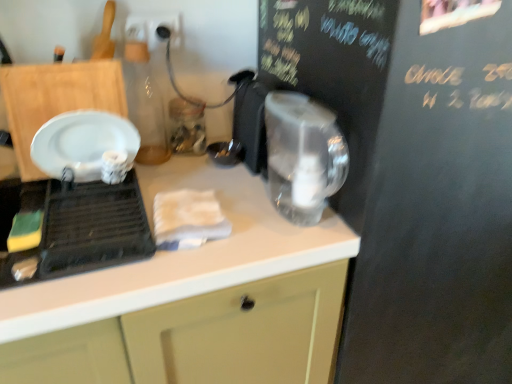
Question: Is point (59, 269) closer or farther from the camera than point (275, 205)?

Choices:
 (A) farther
 (B) closer

Answer: (B)

Question: Is white glossy plate at left in front of or behind transparent plastic kettle at center in the image?

Choices:
 (A) behind
 (B) front

Answer: (B)

Question: Which object is positioned farthest from the white glossy plate at left?

Choices:
 (A) transparent plastic kettle at center
 (B) white matte countertop at center
 (C) black chalkboard at upper right

Answer: (C)

Question: Estimate the real-world distances between objects in this image. Which object is farther from the transparent plastic kettle at center?

Choices:
 (A) white matte countertop at center
 (B) white glossy plate at left
 (C) black chalkboard at upper right

Answer: (B)